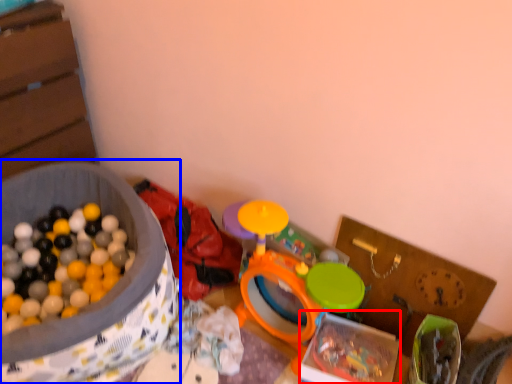
Question: Among these objects, which one is farthest to the camera, box (highlighted by a red box) or box (highlighted by a blue box)?

Choices:
 (A) box
 (B) box

Answer: (A)